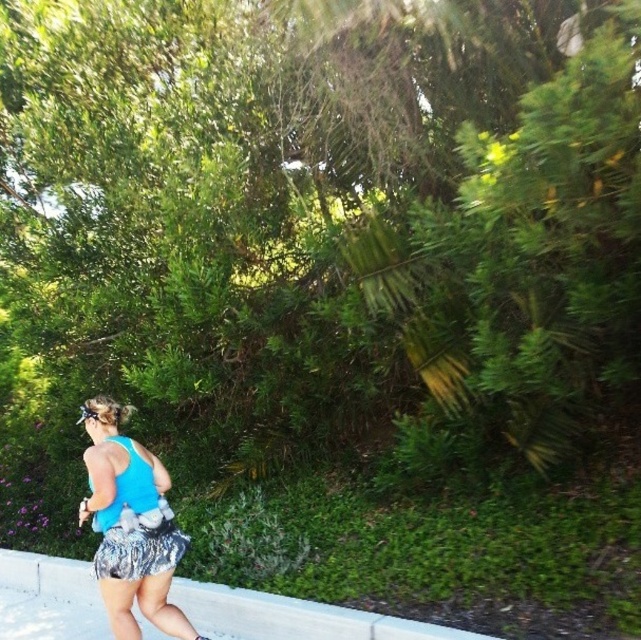
Question: Which object appears farthest from the camera in this image?

Choices:
 (A) gray concrete curb at lower center
 (B) blue fabric tank top at center

Answer: (B)

Question: Is blue fabric tank top at center thinner than gray concrete curb at lower center?

Choices:
 (A) no
 (B) yes

Answer: (B)

Question: Which object is closer to the camera taking this photo?

Choices:
 (A) sparkly metallic shorts at lower center
 (B) gray concrete curb at lower center

Answer: (B)

Question: Which point appears closest to the camera in this image?

Choices:
 (A) (113, 605)
 (B) (156, 570)
 (C) (17, 556)

Answer: (A)

Question: Does gray concrete curb at lower center appear on the right side of sparkly metallic shorts at lower center?

Choices:
 (A) no
 (B) yes

Answer: (B)

Question: Can you confirm if blue fabric tank top at center is wider than sparkly metallic shorts at lower center?

Choices:
 (A) no
 (B) yes

Answer: (B)